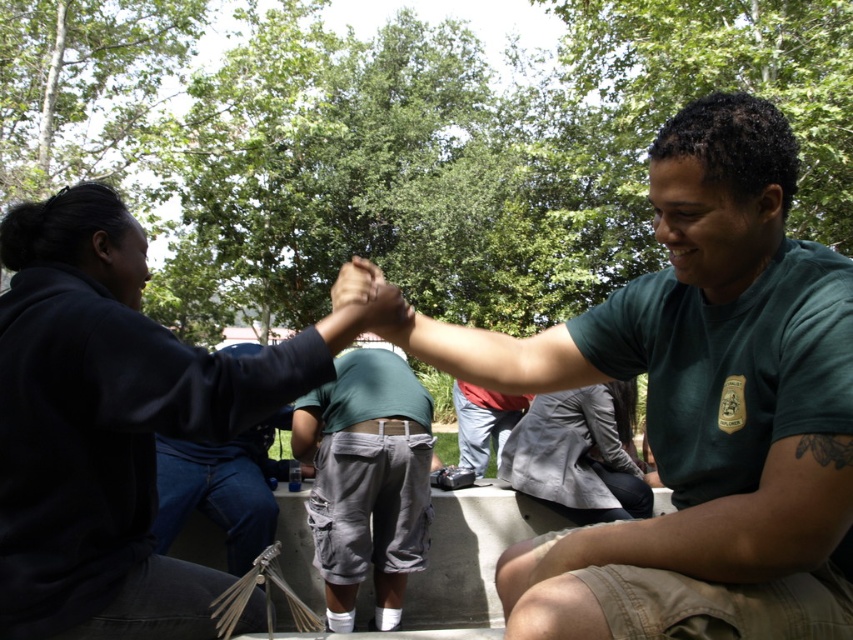
Question: Based on their relative distances, which object is nearer to the dark blue fabric shirt at upper left?

Choices:
 (A) green uniform at center
 (B) red shirt at center
 (C) gray cotton cargo shorts at center

Answer: (A)

Question: Which of the following is the closest to the observer?

Choices:
 (A) green uniform at center
 (B) red shirt at center

Answer: (A)

Question: From the image, what is the correct spatial relationship of gray cotton cargo shorts at center in relation to red shirt at center?

Choices:
 (A) right
 (B) left

Answer: (B)

Question: From the image, what is the correct spatial relationship of green uniform at center in relation to red shirt at center?

Choices:
 (A) above
 (B) below

Answer: (A)

Question: Estimate the real-world distances between objects in this image. Which object is farther from the red shirt at center?

Choices:
 (A) dark blue fabric shirt at upper left
 (B) green uniform at center
 (C) gray cotton cargo shorts at center

Answer: (A)

Question: Can you confirm if green uniform at center is smaller than dark blue fabric shirt at upper left?

Choices:
 (A) yes
 (B) no

Answer: (B)